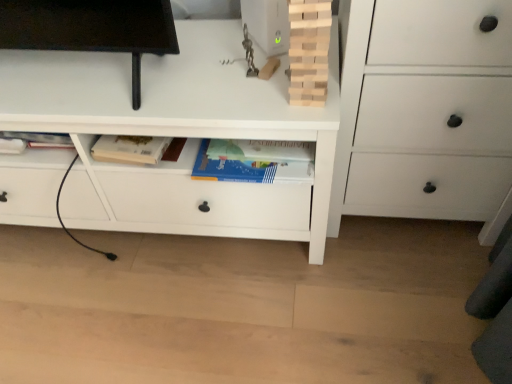
How much space does white matte chest of drawers at right, which ranks as the 1th chest of drawers in right-to-left order, occupy vertically?

The height of white matte chest of drawers at right, which ranks as the 1th chest of drawers in right-to-left order, is 30.44 inches.

Where is `natural wood tower at upper center`? The width and height of the screenshot is (512, 384). natural wood tower at upper center is located at coordinates (309, 51).

Considering the sizes of objects white matte chest of drawers at right, which ranks as the 1th chest of drawers in right-to-left order, and white matte chest of drawers at center, the first chest of drawers when ordered from left to right, in the image provided, who is bigger, white matte chest of drawers at right, which ranks as the 1th chest of drawers in right-to-left order, or white matte chest of drawers at center, the first chest of drawers when ordered from left to right,?

Bigger between the two is white matte chest of drawers at center, the first chest of drawers when ordered from left to right.

Does white matte chest of drawers at right, which ranks as the 1th chest of drawers in right-to-left order, lie behind white matte chest of drawers at center, the first chest of drawers when ordered from left to right?

No, white matte chest of drawers at right, which ranks as the 1th chest of drawers in right-to-left order, is in front of white matte chest of drawers at center, the first chest of drawers when ordered from left to right.

Between white matte chest of drawers at right, which ranks as the 1th chest of drawers in right-to-left order, and white matte chest of drawers at center, the first chest of drawers when ordered from left to right, which one has less height?

Standing shorter between the two is white matte chest of drawers at center, the first chest of drawers when ordered from left to right.

Is white matte chest of drawers at right, the second chest of drawers from the left, at the right side of white matte chest of drawers at center, the second chest of drawers when ordered from right to left?

Correct, you'll find white matte chest of drawers at right, the second chest of drawers from the left, to the right of white matte chest of drawers at center, the second chest of drawers when ordered from right to left.

Would you say white matte chest of drawers at center, the second chest of drawers when ordered from right to left, is outside natural wood tower at upper center?

That's correct, white matte chest of drawers at center, the second chest of drawers when ordered from right to left, is outside of natural wood tower at upper center.

Could you tell me if white matte chest of drawers at center, the first chest of drawers when ordered from left to right, is turned towards natural wood tower at upper center?

No, white matte chest of drawers at center, the first chest of drawers when ordered from left to right, does not turn towards natural wood tower at upper center.

Is white matte chest of drawers at center, the first chest of drawers when ordered from left to right, taller than natural wood tower at upper center?

Yes.

Is natural wood tower at upper center wider or thinner than white matte chest of drawers at center, the second chest of drawers when ordered from right to left?

natural wood tower at upper center is thinner than white matte chest of drawers at center, the second chest of drawers when ordered from right to left.

Would you say natural wood tower at upper center is inside or outside white matte chest of drawers at center, the second chest of drawers when ordered from right to left?

natural wood tower at upper center cannot be found inside white matte chest of drawers at center, the second chest of drawers when ordered from right to left.

Can you confirm if natural wood tower at upper center is shorter than white matte chest of drawers at center, the first chest of drawers when ordered from left to right?

Indeed, natural wood tower at upper center has a lesser height compared to white matte chest of drawers at center, the first chest of drawers when ordered from left to right.

Relative to white matte chest of drawers at center, the second chest of drawers when ordered from right to left, is natural wood tower at upper center in front or behind?

Visually, natural wood tower at upper center is located in front of white matte chest of drawers at center, the second chest of drawers when ordered from right to left.

Considering the relative sizes of white matte chest of drawers at right, the second chest of drawers from the left, and natural wood tower at upper center in the image provided, is white matte chest of drawers at right, the second chest of drawers from the left, wider than natural wood tower at upper center?

Correct, the width of white matte chest of drawers at right, the second chest of drawers from the left, exceeds that of natural wood tower at upper center.

Can you see white matte chest of drawers at right, the second chest of drawers from the left, touching natural wood tower at upper center?

No, white matte chest of drawers at right, the second chest of drawers from the left, is not beside natural wood tower at upper center.

Looking at this image, is white matte chest of drawers at right, which ranks as the 1th chest of drawers in right-to-left order, facing towards natural wood tower at upper center?

No, white matte chest of drawers at right, which ranks as the 1th chest of drawers in right-to-left order, is not aimed at natural wood tower at upper center.

Based on the photo, between white matte chest of drawers at center, the first chest of drawers when ordered from left to right, and white matte chest of drawers at right, the second chest of drawers from the left, which one has larger width?

white matte chest of drawers at center, the first chest of drawers when ordered from left to right.

From a real-world perspective, is white matte chest of drawers at center, the second chest of drawers when ordered from right to left, physically above white matte chest of drawers at right, which ranks as the 1th chest of drawers in right-to-left order?

Actually, white matte chest of drawers at center, the second chest of drawers when ordered from right to left, is physically below white matte chest of drawers at right, which ranks as the 1th chest of drawers in right-to-left order, in the real world.

At what (x,y) coordinates should I click in order to perform the action: click on the chest of drawers in front of the white matte chest of drawers at center, the first chest of drawers when ordered from left to right. Please return your answer as a coordinate pair (x, y). This screenshot has width=512, height=384. Looking at the image, I should click on (425, 112).

Is point (489, 189) more distant than point (398, 78)?

Yes, it is behind point (398, 78).

Which of these two, natural wood tower at upper center or white matte chest of drawers at right, the second chest of drawers from the left, is wider?

Wider between the two is white matte chest of drawers at right, the second chest of drawers from the left.

From a real-world perspective, who is located lower, natural wood tower at upper center or white matte chest of drawers at right, which ranks as the 1th chest of drawers in right-to-left order?

white matte chest of drawers at right, which ranks as the 1th chest of drawers in right-to-left order.

Which of these two, natural wood tower at upper center or white matte chest of drawers at right, the second chest of drawers from the left, stands taller?

white matte chest of drawers at right, the second chest of drawers from the left.

Which is behind, natural wood tower at upper center or white matte chest of drawers at right, the second chest of drawers from the left?

Positioned behind is natural wood tower at upper center.

Where is `chest of drawers above the white matte chest of drawers at center, the second chest of drawers when ordered from right to left (from a real-world perspective)`? The image size is (512, 384). chest of drawers above the white matte chest of drawers at center, the second chest of drawers when ordered from right to left (from a real-world perspective) is located at coordinates (425, 112).

The height and width of the screenshot is (384, 512). What are the coordinates of `book on the right side of white matte chest of drawers at center, the first chest of drawers when ordered from left to right` in the screenshot? It's located at (309, 51).

Estimate the real-world distances between objects in this image. Which object is further from natural wood tower at upper center, white matte chest of drawers at right, which ranks as the 1th chest of drawers in right-to-left order, or white matte chest of drawers at center, the second chest of drawers when ordered from right to left?

white matte chest of drawers at center, the second chest of drawers when ordered from right to left, is positioned further to the anchor natural wood tower at upper center.

From the image, which object appears to be farther from white matte chest of drawers at center, the second chest of drawers when ordered from right to left, natural wood tower at upper center or white matte chest of drawers at right, the second chest of drawers from the left?

natural wood tower at upper center.

Estimate the real-world distances between objects in this image. Which object is closer to white matte chest of drawers at right, the second chest of drawers from the left, white matte chest of drawers at center, the second chest of drawers when ordered from right to left, or natural wood tower at upper center?

white matte chest of drawers at center, the second chest of drawers when ordered from right to left, is closer to white matte chest of drawers at right, the second chest of drawers from the left.

Estimate the real-world distances between objects in this image. Which object is further from white matte chest of drawers at right, the second chest of drawers from the left, natural wood tower at upper center or white matte chest of drawers at center, the second chest of drawers when ordered from right to left?

natural wood tower at upper center is further to white matte chest of drawers at right, the second chest of drawers from the left.

Which object lies further to the anchor point white matte chest of drawers at center, the second chest of drawers when ordered from right to left, white matte chest of drawers at right, which ranks as the 1th chest of drawers in right-to-left order, or natural wood tower at upper center?

natural wood tower at upper center is further to white matte chest of drawers at center, the second chest of drawers when ordered from right to left.

Based on their spatial positions, is white matte chest of drawers at center, the first chest of drawers when ordered from left to right, or white matte chest of drawers at right, which ranks as the 1th chest of drawers in right-to-left order, further from natural wood tower at upper center?

Based on the image, white matte chest of drawers at center, the first chest of drawers when ordered from left to right, appears to be further to natural wood tower at upper center.

The image size is (512, 384). I want to click on book between white matte chest of drawers at center, the second chest of drawers when ordered from right to left, and white matte chest of drawers at right, which ranks as the 1th chest of drawers in right-to-left order, in the horizontal direction, so click(x=309, y=51).